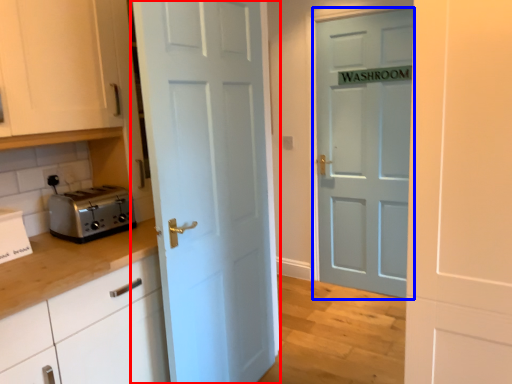
Question: Among these objects, which one is nearest to the camera, door (highlighted by a red box) or door (highlighted by a blue box)?

Choices:
 (A) door
 (B) door

Answer: (A)